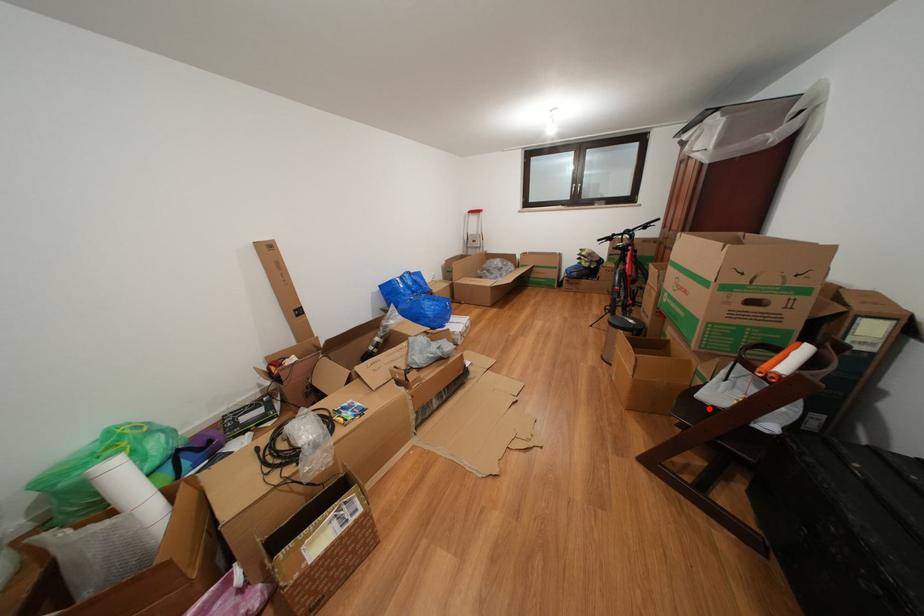
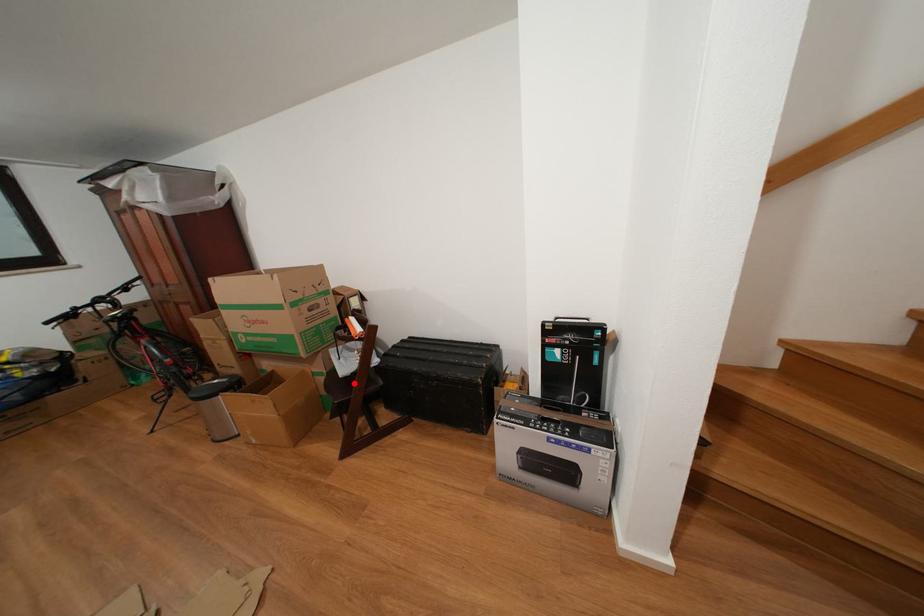
I am providing you with two images of the same scene from different viewpoints. A red point is marked on the first image and another point is marked on the second image. Is the marked point in image1 the same physical position as the marked point in image2?

Yes